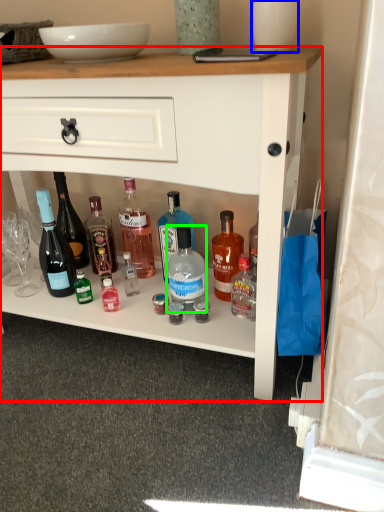
Question: Based on their relative distances, which object is nearer to desk (highlighted by a red box)? Choose from glass vase (highlighted by a blue box) and bottle (highlighted by a green box).

Choices:
 (A) glass vase
 (B) bottle

Answer: (B)